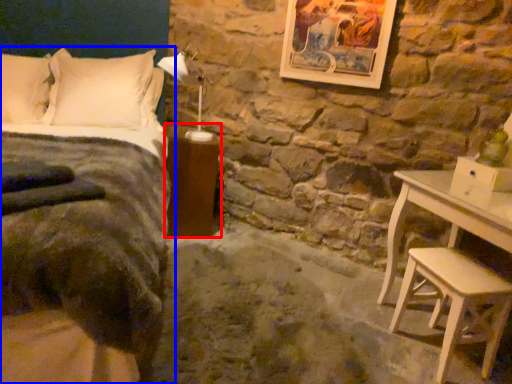
Question: Which object appears closest to the camera in this image, nightstand (highlighted by a red box) or bed (highlighted by a blue box)?

Choices:
 (A) nightstand
 (B) bed

Answer: (B)